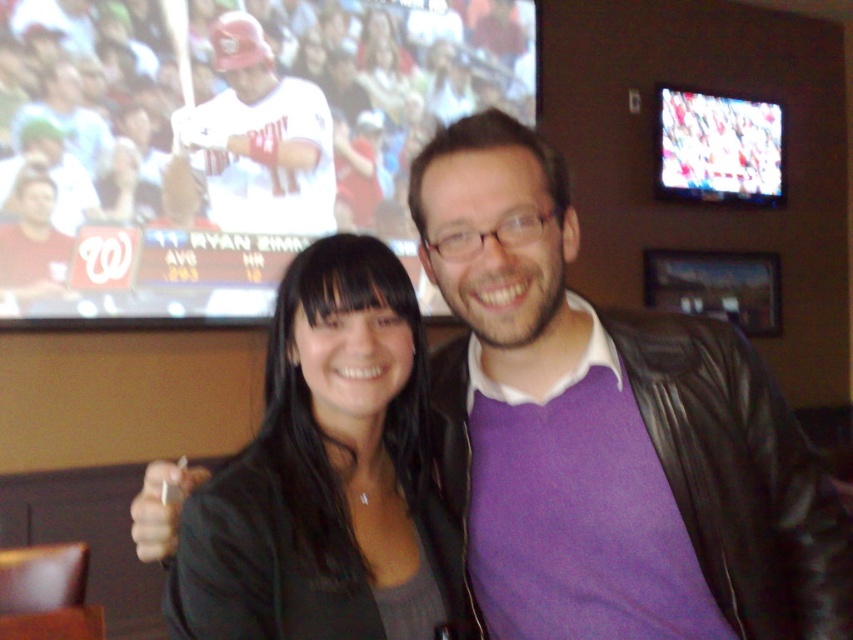
Is purple matte sweater at center bigger than black leather jacket at center?

Indeed, purple matte sweater at center has a larger size compared to black leather jacket at center.

Does purple matte sweater at center appear over black leather jacket at center?

Yes.

Locate an element on the screen. This screenshot has height=640, width=853. purple matte sweater at center is located at coordinates (607, 432).

Does purple matte sweater at center appear on the left side of white matte key at center?

No, purple matte sweater at center is not to the left of white matte key at center.

Is purple matte sweater at center further to camera compared to white matte key at center?

No, purple matte sweater at center is closer to the viewer.

The width and height of the screenshot is (853, 640). Find the location of `purple matte sweater at center`. purple matte sweater at center is located at coordinates (607, 432).

The height and width of the screenshot is (640, 853). Identify the location of purple matte sweater at center. (607, 432).

Is black leather jacket at center bigger than matte white jersey at upper left?

No, black leather jacket at center is not bigger than matte white jersey at upper left.

Does black leather jacket at center have a lesser width compared to matte white jersey at upper left?

Indeed, black leather jacket at center has a lesser width compared to matte white jersey at upper left.

Who is more forward, (363, 328) or (312, 180)?

Point (363, 328) is more forward.

Find the location of `black leather jacket at center`. black leather jacket at center is located at coordinates (323, 476).